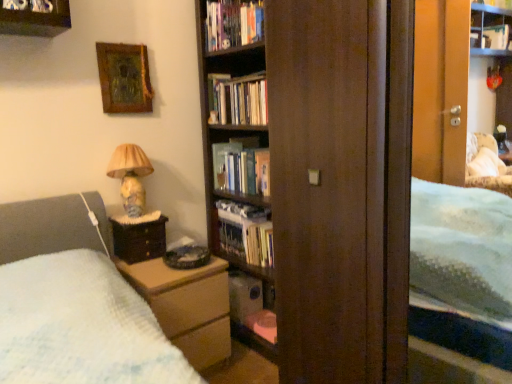
This screenshot has height=384, width=512. I want to click on free space in front of brown wood nightstand at left, so click(x=143, y=267).